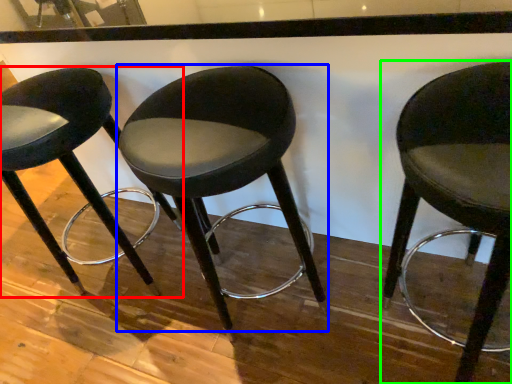
Question: Considering the real-world distances, which object is closest to chair (highlighted by a red box)? chair (highlighted by a blue box) or chair (highlighted by a green box).

Choices:
 (A) chair
 (B) chair

Answer: (A)